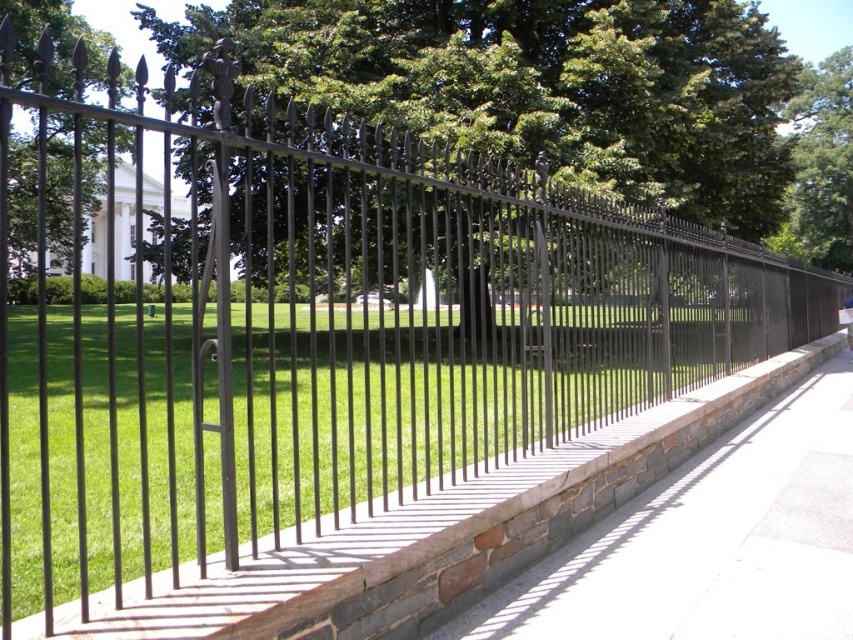
You are standing at the point marked by point (541,84) in the park. What is the nearest object to you?

The nearest object to you is the green leafy tree at center marked by point (541,84).

You are a gardener standing on the gray concrete pavement at center and want to water the green leafy tree at center. Which direction should you move to reach the tree?

The green leafy tree at center is positioned on the left side of the gray concrete pavement at center, so you should move to your left to reach the tree.

You are standing at the decorative metal fence in the park and want to walk towards the point labeled as point (810, 259). There is an obstacle at point (398, 76). Will you encounter this obstacle before reaching your destination?

Yes, you will encounter the obstacle at point (398, 76) before reaching point (810, 259) because point (398, 76) is in front of point (810, 259).